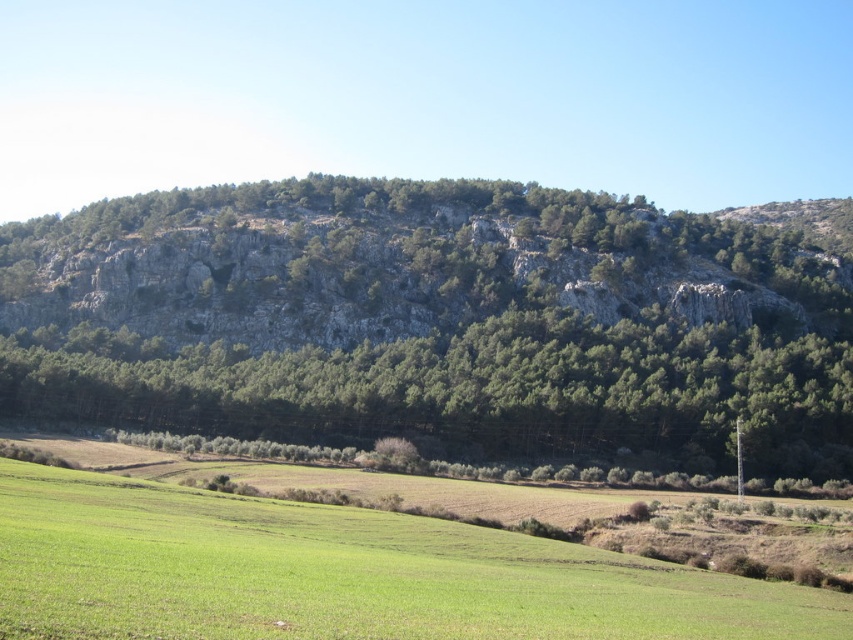
Is point (751, 236) more distant than point (189, 541)?

Yes.

How far apart are rocky gray mountain at center and green grass pasture at lower left?

rocky gray mountain at center is 166.64 meters away from green grass pasture at lower left.

This screenshot has height=640, width=853. Describe the element at coordinates (416, 260) in the screenshot. I see `rocky gray mountain at center` at that location.

I want to click on rocky gray mountain at center, so click(x=416, y=260).

Based on the photo, can you confirm if green leafy trees at center is thinner than green grass pasture at lower left?

In fact, green leafy trees at center might be wider than green grass pasture at lower left.

Does green leafy trees at center have a greater width compared to green grass pasture at lower left?

Yes, green leafy trees at center is wider than green grass pasture at lower left.

Does point (838, 458) come closer to viewer compared to point (486, 532)?

No.

Image resolution: width=853 pixels, height=640 pixels. I want to click on green leafy trees at center, so click(469, 392).

Is rocky gray mountain at center further to camera compared to green leafy trees at center?

Yes, rocky gray mountain at center is further from the viewer.

Who is higher up, rocky gray mountain at center or green leafy trees at center?

rocky gray mountain at center is above.

Is point (288, 275) in front of point (573, 358)?

No, it is behind (573, 358).

The width and height of the screenshot is (853, 640). I want to click on rocky gray mountain at center, so click(x=416, y=260).